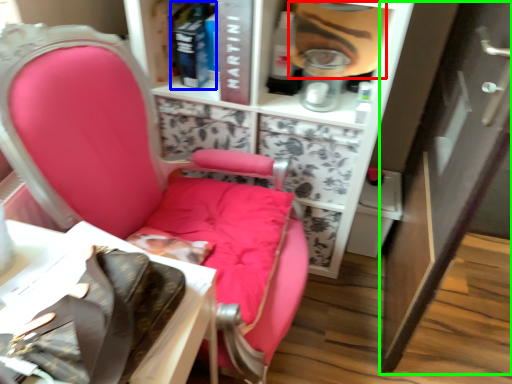
Question: Estimate the real-world distances between objects in this image. Which object is closer to person (highlighted by a red box), book (highlighted by a blue box) or cabinetry (highlighted by a green box)?

Choices:
 (A) book
 (B) cabinetry

Answer: (A)